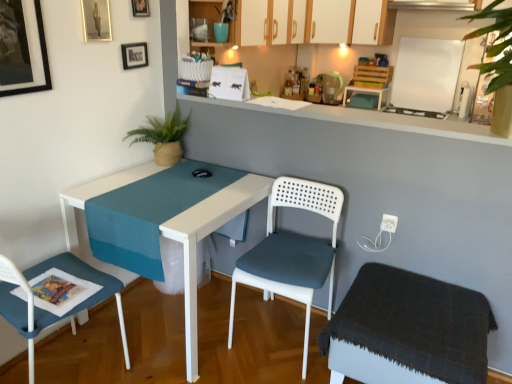
Find the location of a particular element. empty space that is ontop of white matte board at upper right (from a real-world perspective) is located at coordinates (432, 35).